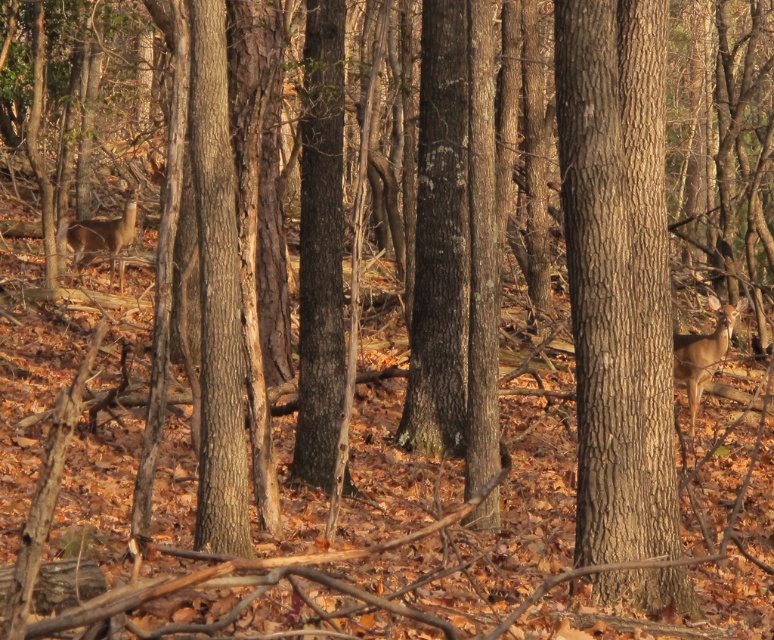
Does point (683, 593) lie in front of point (98, 246)?

Yes.

Does brown rough bark tree at center have a greater height compared to brown fur deer at left?

Yes, brown rough bark tree at center is taller than brown fur deer at left.

What are the coordinates of `brown rough bark tree at center` in the screenshot? It's located at (617, 273).

Image resolution: width=774 pixels, height=640 pixels. I want to click on brown rough bark tree at center, so click(617, 273).

Is the position of brown matte deer at right more distant than that of brown fur deer at left?

That is False.

Can you confirm if brown matte deer at right is shorter than brown fur deer at left?

Yes, brown matte deer at right is shorter than brown fur deer at left.

Locate an element on the screen. The height and width of the screenshot is (640, 774). brown matte deer at right is located at coordinates 701,353.

Between point (670, 385) and point (677, 349), which one is positioned in front?

Point (670, 385) is in front.

Measure the distance between point (576, 80) and camera.

Point (576, 80) and camera are 8.72 meters apart.

Between point (591, 97) and point (687, 336), which one is positioned in front?

Point (591, 97) is more forward.

What are the coordinates of `brown rough bark tree at center` in the screenshot? It's located at (617, 273).